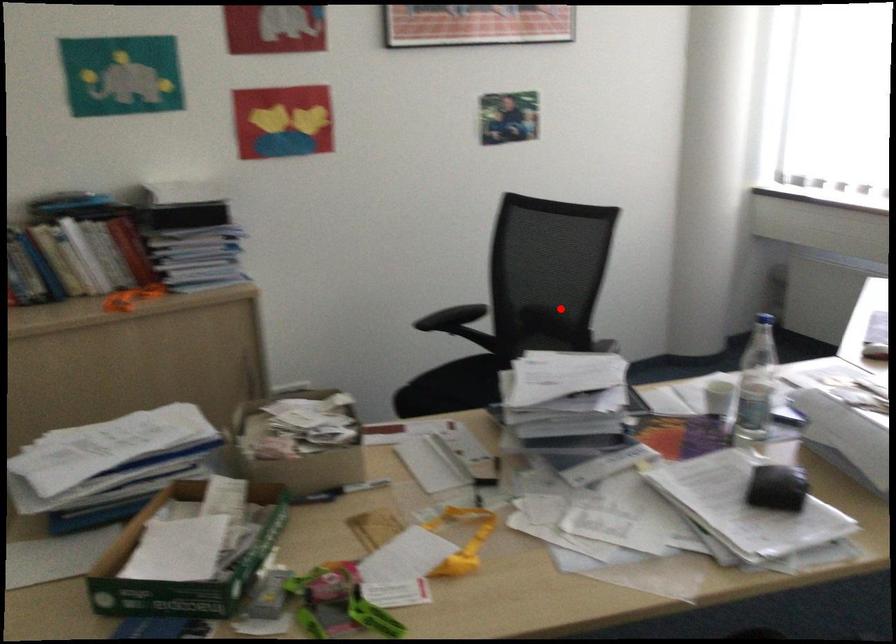
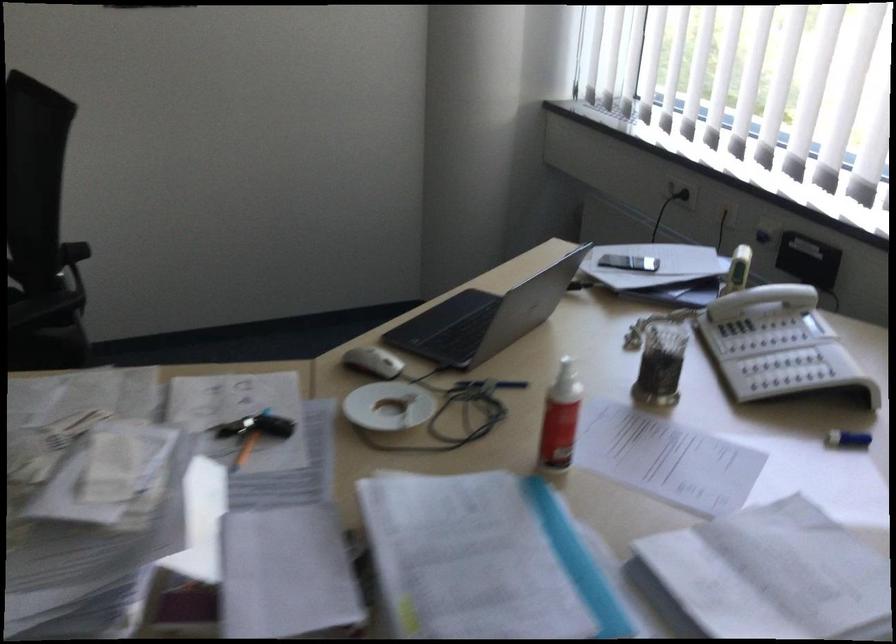
Question: A red point is marked in image1. In image2, is the corresponding 3D point closer to the camera or farther? Reply with the corresponding letter.

Choices:
 (A) The corresponding 3D point is closer.
 (B) The corresponding 3D point is farther.

Answer: (A)